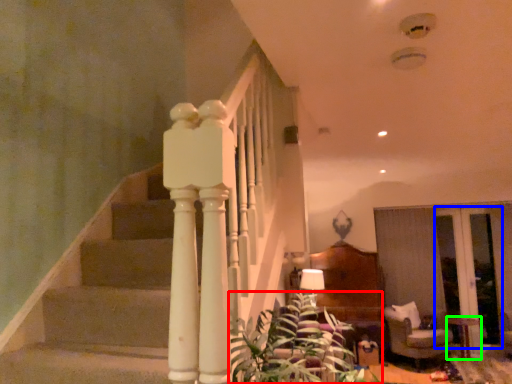
Question: Which object is the closest to the plant (highlighted by a red box)? Choose among these: glass door (highlighted by a blue box) or table (highlighted by a green box).

Choices:
 (A) glass door
 (B) table

Answer: (B)